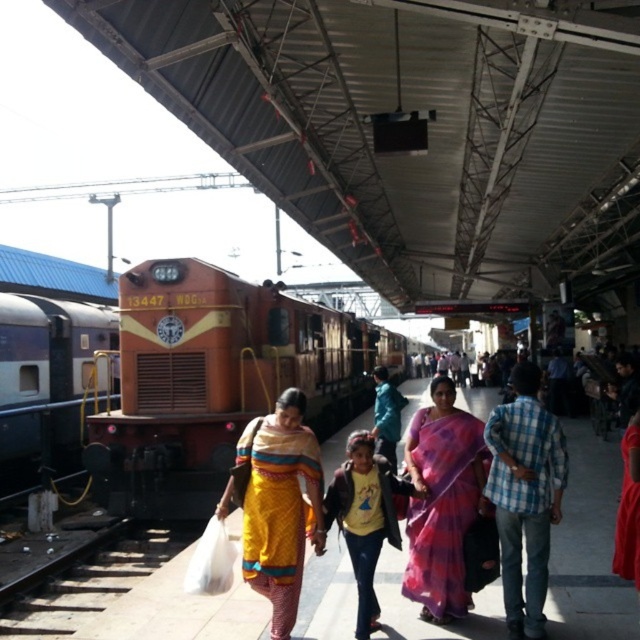
Question: Is yellow silk saree at center in front of pink silk saree at center?

Choices:
 (A) yes
 (B) no

Answer: (A)

Question: Estimate the real-world distances between objects in this image. Which object is closer to the yellow cotton shirt at center?

Choices:
 (A) orange metallic train at center
 (B) yellow printed sari at center
 (C) matte orange train at left
 (D) pink silk saree at center

Answer: (D)

Question: Can you confirm if orange metallic train at center is thinner than pink silk saree at center?

Choices:
 (A) no
 (B) yes

Answer: (A)

Question: Which point is closer to the camera taking this photo?

Choices:
 (A) (301, 449)
 (B) (401, 582)
 (C) (385, 516)

Answer: (A)

Question: Is yellow silk saree at center to the left of pink silk saree at center from the viewer's perspective?

Choices:
 (A) yes
 (B) no

Answer: (B)

Question: Which of the following is the farthest from the observer?

Choices:
 (A) (64, 372)
 (B) (353, 492)

Answer: (A)